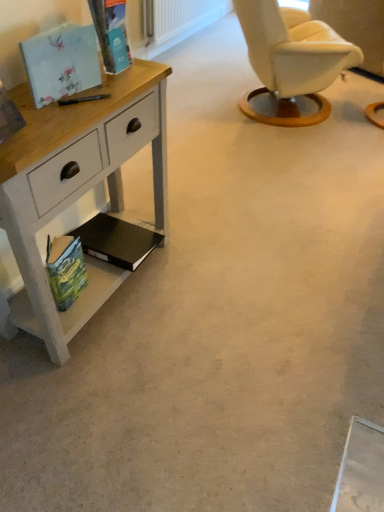
Locate an element on the screen. empty space that is to the right of white painted wood desk at left is located at coordinates (209, 293).